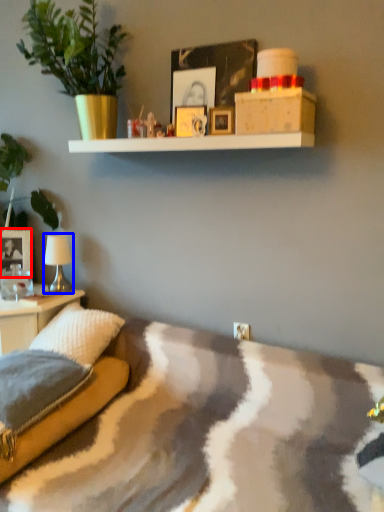
Question: Which point is further to the camera, picture frame (highlighted by a red box) or table lamp (highlighted by a blue box)?

Choices:
 (A) picture frame
 (B) table lamp

Answer: (A)